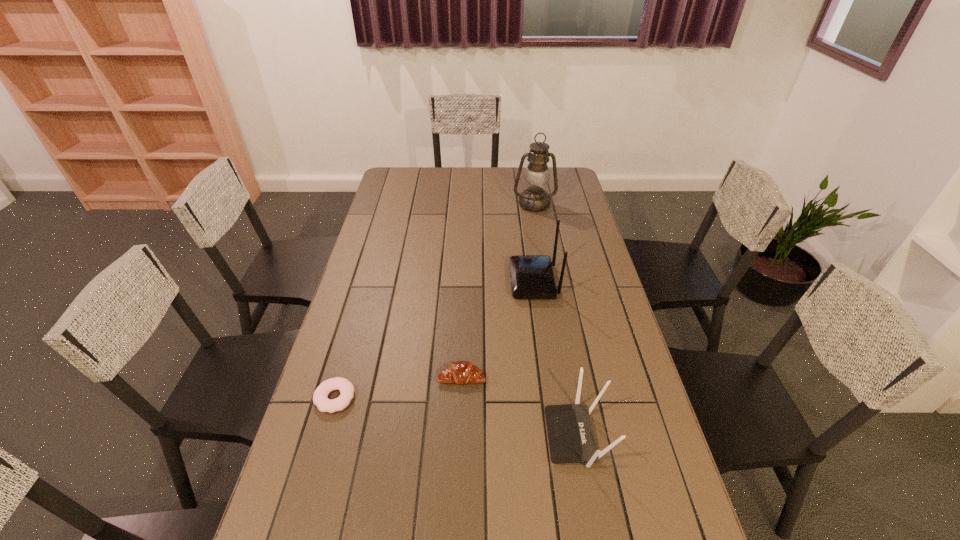
Locate an element on the screen. This screenshot has height=540, width=960. free region located 0.260m on the back of the tallest object is located at coordinates (528, 169).

This screenshot has height=540, width=960. Find the location of `vacant space positioned 0.050m on the front-facing side of the farther router`. vacant space positioned 0.050m on the front-facing side of the farther router is located at coordinates (496, 281).

Find the location of `vacant space situated on the front-facing side of the farther router`. vacant space situated on the front-facing side of the farther router is located at coordinates (451, 281).

Locate an element on the screen. blank space located on the front-facing side of the farther router is located at coordinates (451, 281).

This screenshot has height=540, width=960. What are the coordinates of `vacant space situated 0.080m on the front-facing side of the shorter router` in the screenshot? It's located at (516, 436).

In order to click on vacant space located 0.140m on the front-facing side of the shorter router in this screenshot , I will do `click(492, 436)`.

The image size is (960, 540). Find the location of `vacant space located on the front-facing side of the shorter router`. vacant space located on the front-facing side of the shorter router is located at coordinates (519, 436).

Where is `blank space located on the front of the fourth object from right to left`? The width and height of the screenshot is (960, 540). blank space located on the front of the fourth object from right to left is located at coordinates (460, 422).

You are a GUI agent. You are given a task and a screenshot of the screen. Output one action in this format:
    pyautogui.click(x=<x>, y=<y>)
    Task: Click on the vacant area located on the back of the leftmost object
    The width and height of the screenshot is (960, 540).
    Given the screenshot: What is the action you would take?
    click(354, 331)

Locate an element on the screen. This screenshot has width=960, height=540. object at the left edge is located at coordinates [x=346, y=388].